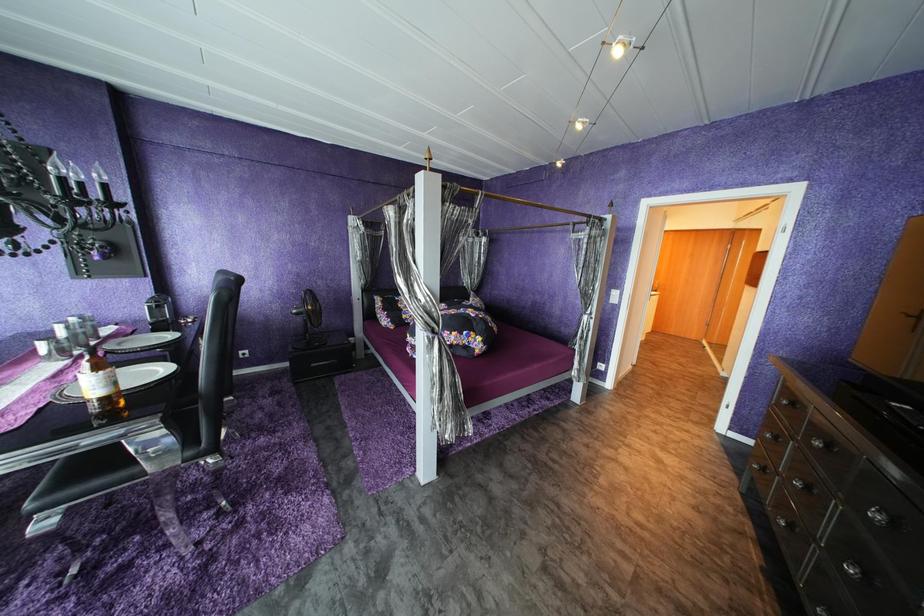
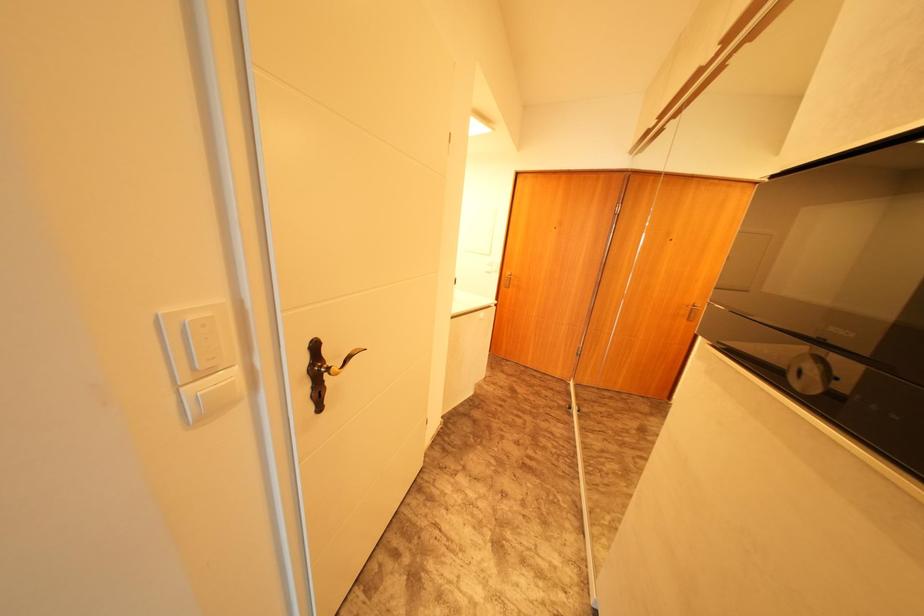
In a continuous first-person perspective shot, in which direction is the camera moving?

The movement direction of the cameraman is right, forward.